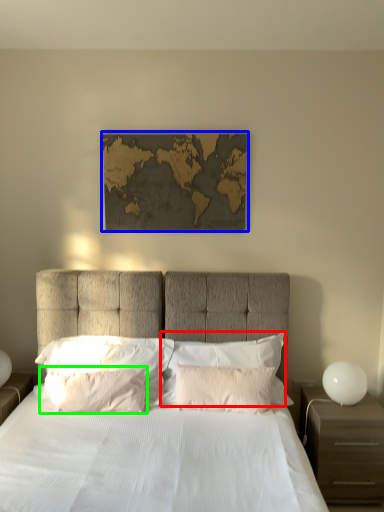
Question: Estimate the real-world distances between objects in this image. Which object is closer to pillow (highlighted by a red box), picture frame (highlighted by a blue box) or pillow (highlighted by a green box)?

Choices:
 (A) picture frame
 (B) pillow

Answer: (B)